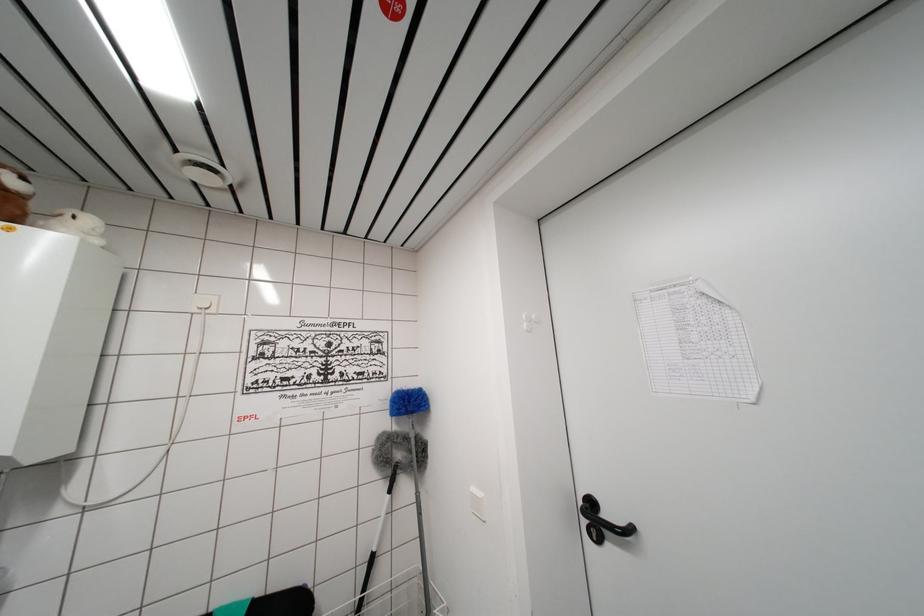
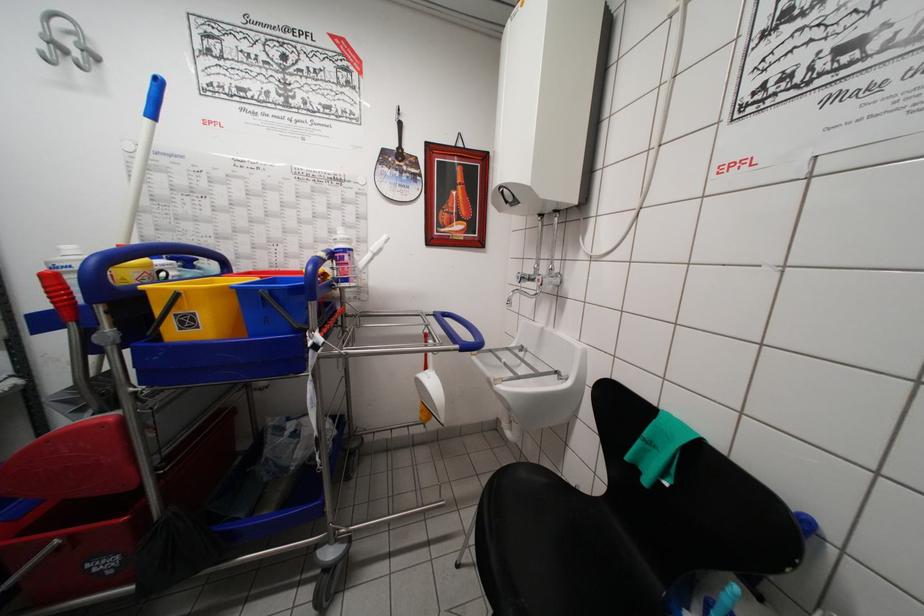
Question: Based on the continuous images, in which direction is the camera rotating? Reply with the corresponding letter.

Choices:
 (A) Left
 (B) Right
 (C) Up
 (D) Down

Answer: (A)